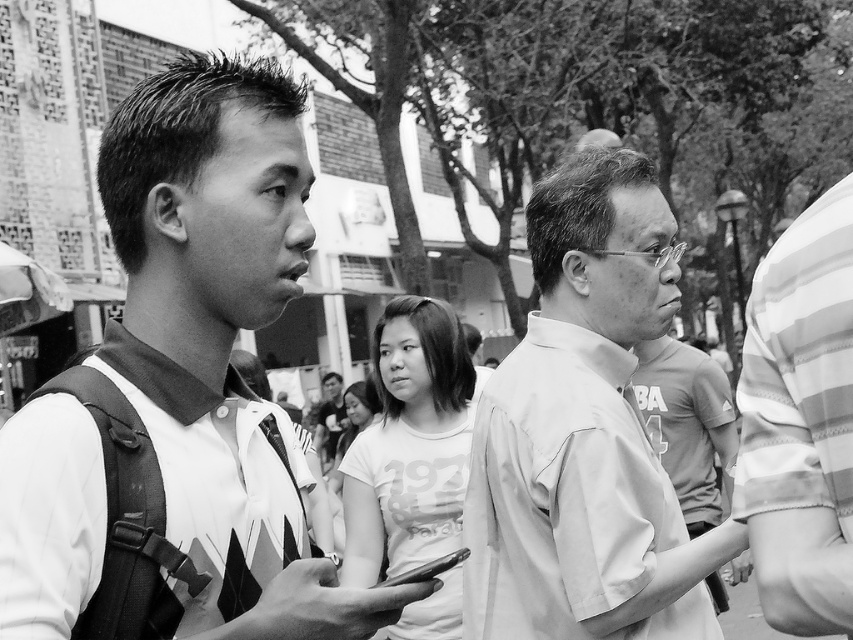
The height and width of the screenshot is (640, 853). Describe the element at coordinates (180, 396) in the screenshot. I see `printed fabric shirt at left` at that location.

Does printed fabric shirt at left appear under white matte t-shirt at center?

Actually, printed fabric shirt at left is above white matte t-shirt at center.

This screenshot has width=853, height=640. Identify the location of printed fabric shirt at left. (180, 396).

Does light gray shirt at center come behind white matte t-shirt at center?

No, it is in front of white matte t-shirt at center.

Between point (561, 557) and point (453, 314), which one is positioned behind?

Positioned behind is point (453, 314).

Locate an element on the screen. This screenshot has height=640, width=853. light gray shirt at center is located at coordinates (585, 433).

Between printed fabric shirt at left and light gray shirt at center, which one has more height?

printed fabric shirt at left is taller.

Who is positioned more to the right, printed fabric shirt at left or light gray shirt at center?

light gray shirt at center

Which is behind, point (154, 184) or point (537, 582)?

The point (537, 582) is more distant.

Where is `printed fabric shirt at left`? printed fabric shirt at left is located at coordinates (180, 396).